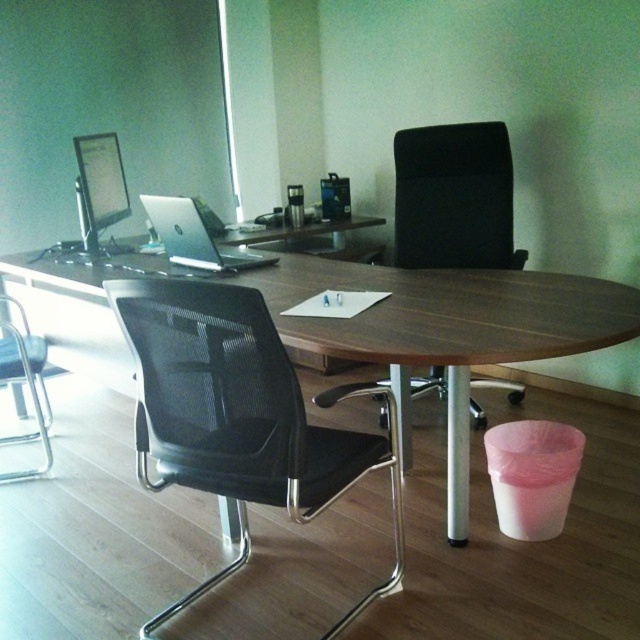
You are sitting in the black mesh chair at left and want to grab the pen from the wooden desk at center. Can you reach it without moving your chair?

The wooden desk at center is closer to the viewer than the black mesh chair at left, so you can reach the pen without needing to move your chair.

In the scene shown: You are standing at the entrance of the office and see the point marked at coordinate (454, 196). Which object is this point located on?

The point marked at coordinate (454, 196) is located on the black mesh chair at center.

Consider the image. You are organizing a meeting in the office and need to ensure there is enough space between the black mesh swivel chair at center and the black mesh chair at center for attendees to move comfortably. According to the office layout, which chair is wider and requires more space?

The black mesh swivel chair at center is wider than the black mesh chair at center, so it requires more space.